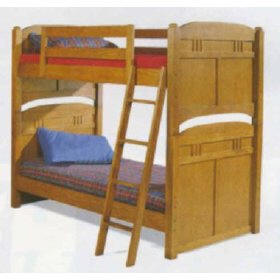
Image resolution: width=280 pixels, height=280 pixels. In order to click on lower head board in this screenshot , I will do `click(47, 118)`.